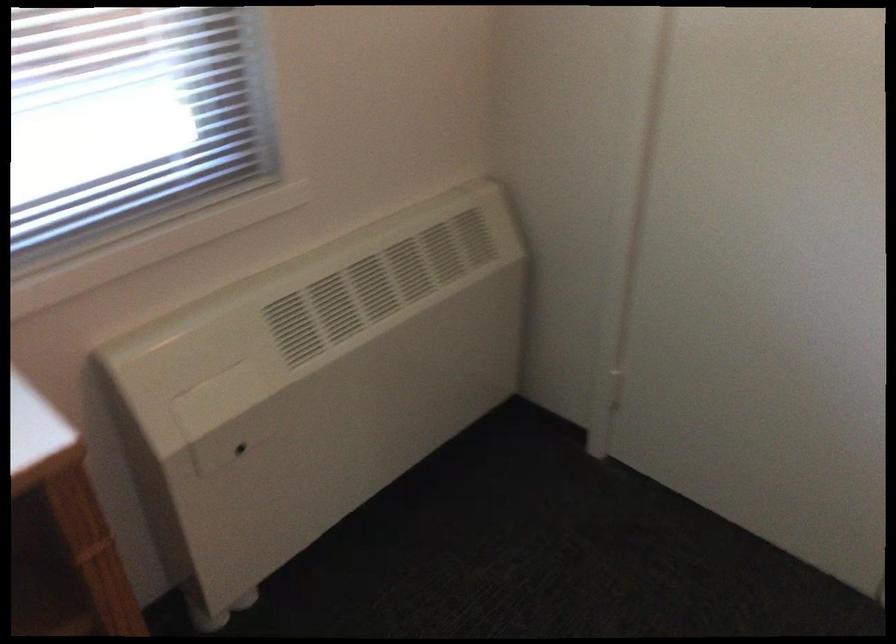
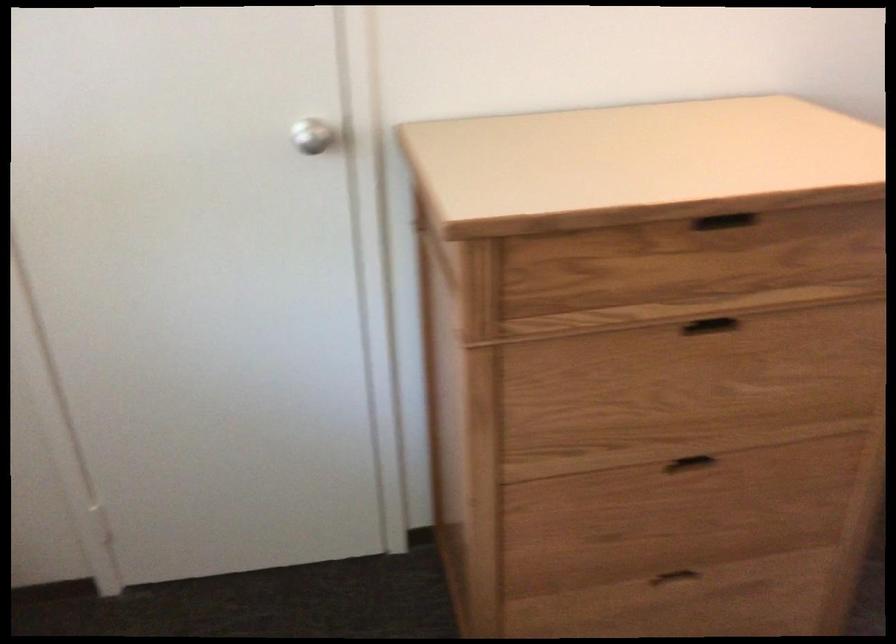
Question: How did the camera likely rotate?

Choices:
 (A) Left
 (B) Right
 (C) Up
 (D) Down

Answer: (B)